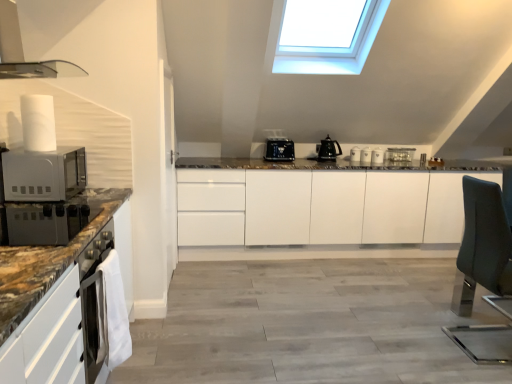
Question: From the image's perspective, does white glossy coffee cup at center, which is the third appliance from back to front, appear lower than teal fabric swivel chair at right?

Choices:
 (A) no
 (B) yes

Answer: (A)

Question: Is white glossy coffee cup at center, which is the third appliance from back to front, at the right side of teal fabric swivel chair at right?

Choices:
 (A) no
 (B) yes

Answer: (A)

Question: Is white glossy coffee cup at center, which is the 3th appliance from right to left, to the left of teal fabric swivel chair at right from the viewer's perspective?

Choices:
 (A) no
 (B) yes

Answer: (B)

Question: Does white glossy coffee cup at center, which is the third appliance in left-to-right order, have a greater width compared to teal fabric swivel chair at right?

Choices:
 (A) yes
 (B) no

Answer: (B)

Question: Is white glossy coffee cup at center, which is the 3th appliance from right to left, positioned far away from teal fabric swivel chair at right?

Choices:
 (A) yes
 (B) no

Answer: (A)

Question: From the image's perspective, is white glossy mugs at center, positioned as the fourth appliance in left-to-right order, positioned above or below teal fabric swivel chair at right?

Choices:
 (A) above
 (B) below

Answer: (A)

Question: Is white glossy mugs at center, positioned as the fourth appliance in left-to-right order, wider or thinner than teal fabric swivel chair at right?

Choices:
 (A) wide
 (B) thin

Answer: (B)

Question: Is white glossy mugs at center, the 2th appliance positioned from the right, taller or shorter than teal fabric swivel chair at right?

Choices:
 (A) short
 (B) tall

Answer: (A)

Question: Considering their positions, is white glossy mugs at center, positioned as the fourth appliance in left-to-right order, located in front of or behind teal fabric swivel chair at right?

Choices:
 (A) front
 (B) behind

Answer: (B)

Question: In terms of height, does white glossy mug at upper center, which is counted as the second appliance, starting from the left, look taller or shorter compared to white matte microwave oven at left?

Choices:
 (A) short
 (B) tall

Answer: (A)

Question: From the image's perspective, is white glossy mug at upper center, placed as the fourth appliance when sorted from front to back, located above or below white matte microwave oven at left?

Choices:
 (A) below
 (B) above

Answer: (B)

Question: Is white glossy mug at upper center, the 2th appliance positioned from the back, wider or thinner than white matte microwave oven at left?

Choices:
 (A) wide
 (B) thin

Answer: (B)

Question: Considering the positions of point (355, 150) and point (4, 182), is point (355, 150) closer or farther from the camera than point (4, 182)?

Choices:
 (A) farther
 (B) closer

Answer: (A)

Question: Does point (26, 152) appear closer or farther from the camera than point (399, 165)?

Choices:
 (A) closer
 (B) farther

Answer: (A)

Question: From a real-world perspective, relative to satin silver toaster at center, which appears as the fifth appliance when viewed from the left, is white matte microwave oven at left vertically above or below?

Choices:
 (A) below
 (B) above

Answer: (B)